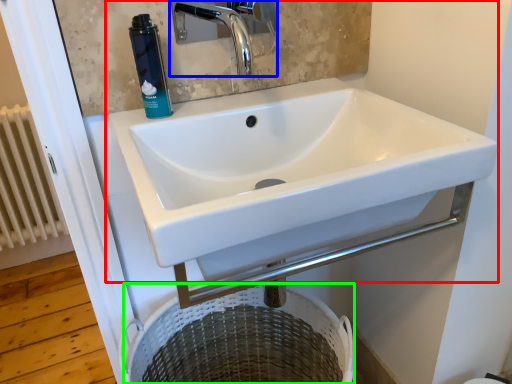
Question: Which is nearer to the sink (highlighted by a red box)? tap (highlighted by a blue box) or laundry basket (highlighted by a green box).

Choices:
 (A) tap
 (B) laundry basket

Answer: (B)